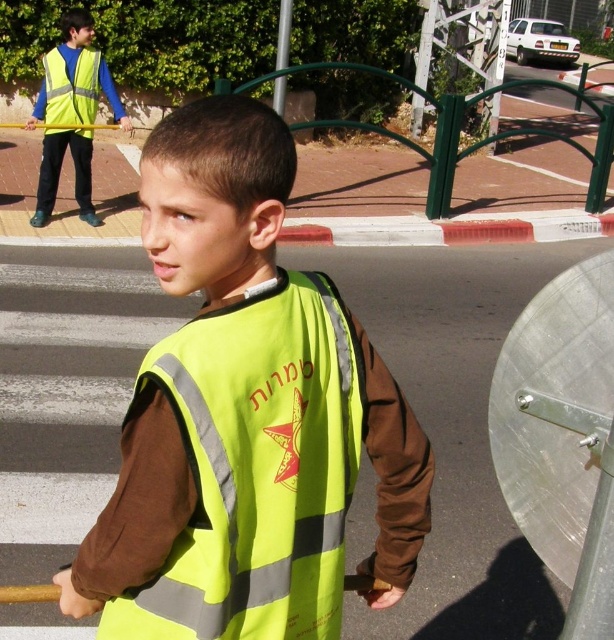
Question: Among these objects, which one is farthest from the camera?

Choices:
 (A) high-visibility fabric safety vest at center
 (B) reflective yellow safety vest at upper left

Answer: (B)

Question: Can you confirm if high-visibility fabric vest at upper left is positioned to the right of reflective yellow safety vest at upper left?

Choices:
 (A) yes
 (B) no

Answer: (A)

Question: Which object is farther from the camera taking this photo?

Choices:
 (A) high-visibility fabric safety vest at center
 (B) reflective yellow safety vest at upper left

Answer: (B)

Question: Does high-visibility fabric safety vest at center appear over high-visibility fabric vest at upper left?

Choices:
 (A) no
 (B) yes

Answer: (A)

Question: Is high-visibility fabric vest at upper left in front of reflective yellow safety vest at upper left?

Choices:
 (A) no
 (B) yes

Answer: (B)

Question: Based on their relative distances, which object is nearer to the reflective yellow vest at center?

Choices:
 (A) high-visibility fabric safety vest at center
 (B) reflective yellow safety vest at upper left
 (C) high-visibility fabric vest at upper left

Answer: (A)